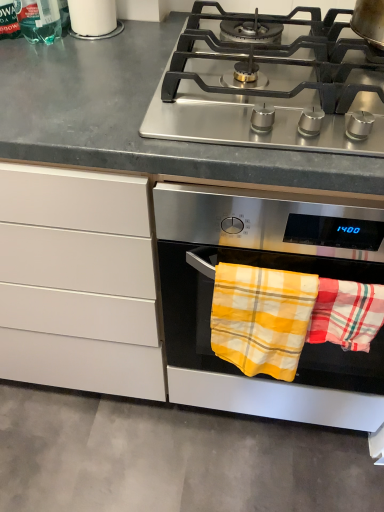
Locate an element on the screen. The width and height of the screenshot is (384, 512). free space in front of white glossy cup at upper left is located at coordinates (87, 58).